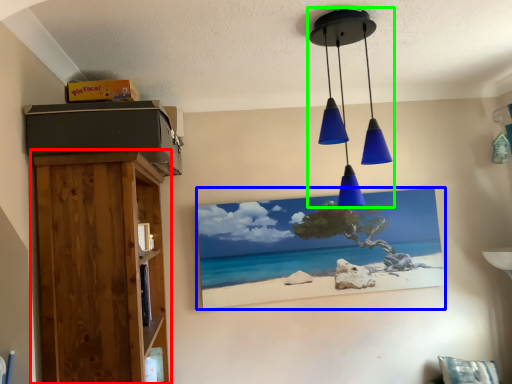
Question: Which is nearer to the furniture (highlighted by a red box)? picture frame (highlighted by a blue box) or lamp (highlighted by a green box).

Choices:
 (A) picture frame
 (B) lamp

Answer: (B)